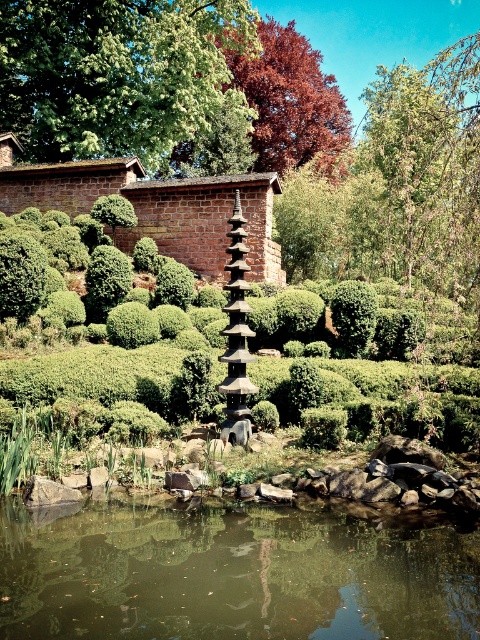
You are planning to place a small wooden boat in the garden scene. The boat requires a water area wider than the green leafy tree at upper center to navigate comfortably. Can the brown reflective water at center accommodate the boat?

The brown reflective water at center has a lesser width compared to green leafy tree at upper center, so it cannot accommodate the boat as it requires a wider area than the tree.

You are an artist painting the garden scene. You notice both the green leafy tree at upper center and the shiny red leaves at upper center in your view. Which of these two objects is closer to the front of your painting?

The shiny red leaves at upper center are closer to the front because the green leafy tree at upper center is positioned under them.

You are standing in the garden and want to take a photo of the green leafy tree at upper center. Considering the distance, do you think you need a zoom lens to capture the entire tree in the frame?

The green leafy tree at upper center is 74.50 feet away from you. Since this distance is quite far, using a zoom lens would help to capture the entire tree in the frame without needing to move closer.